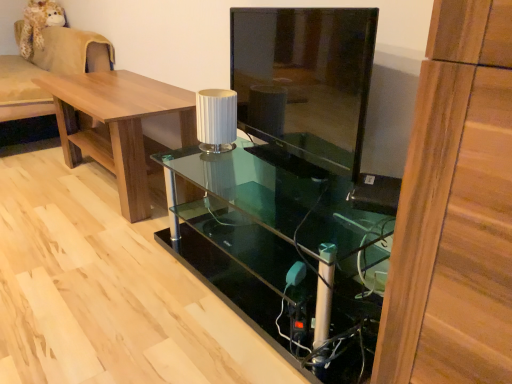
Locate an element on the screen. transparent glass tv stand at center is located at coordinates (305, 78).

The width and height of the screenshot is (512, 384). What are the coordinates of `brown wood table at left` in the screenshot? It's located at (117, 125).

Identify the location of transparent glass desk at center. This screenshot has height=384, width=512. (283, 253).

From their relative heights in the image, would you say white ribbed lampshade at center is taller or shorter than brown wood table at left?

white ribbed lampshade at center is shorter than brown wood table at left.

From a real-world perspective, between white ribbed lampshade at center and brown wood table at left, who is vertically lower?

From a 3D spatial view, brown wood table at left is below.

Is white ribbed lampshade at center looking in the opposite direction of brown wood table at left?

white ribbed lampshade at center is not turned away from brown wood table at left.

Would you say white ribbed lampshade at center is to the left or to the right of brown wood table at left in the picture?

In the image, white ribbed lampshade at center appears on the right side of brown wood table at left.

How many degrees apart are the facing directions of transparent glass tv stand at center and white ribbed lampshade at center?

4.01 degrees.

Is transparent glass tv stand at center looking in the opposite direction of white ribbed lampshade at center?

Yes.

The width and height of the screenshot is (512, 384). Find the location of `lamp below the transparent glass tv stand at center (from the image's perspective)`. lamp below the transparent glass tv stand at center (from the image's perspective) is located at coordinates (216, 120).

Considering the relative sizes of transparent glass tv stand at center and white ribbed lampshade at center in the image provided, is transparent glass tv stand at center wider than white ribbed lampshade at center?

Incorrect, the width of transparent glass tv stand at center does not surpass that of white ribbed lampshade at center.

Could you tell me if transparent glass desk at center is turned towards transparent glass tv stand at center?

No, transparent glass desk at center is not aimed at transparent glass tv stand at center.

From a real-world perspective, which is physically above, transparent glass desk at center or transparent glass tv stand at center?

In real-world perspective, transparent glass tv stand at center is above.

Which of these two, transparent glass desk at center or transparent glass tv stand at center, is smaller?

transparent glass tv stand at center is smaller.

Is transparent glass desk at center in front of transparent glass tv stand at center?

That is True.

Are brown wood table at left and beige fabric couch at left located far from each other?

No, brown wood table at left is in close proximity to beige fabric couch at left.

Does point (115, 157) appear closer or farther from the camera than point (95, 40)?

Clearly, point (115, 157) is closer to the camera than point (95, 40).

Considering the relative sizes of brown wood table at left and beige fabric couch at left in the image provided, is brown wood table at left taller than beige fabric couch at left?

In fact, brown wood table at left may be shorter than beige fabric couch at left.

At what (x,y) coordinates should I click in order to perform the action: click on desk that is under the beige fabric couch at left (from a real-world perspective). Please return your answer as a coordinate pair (x, y). Looking at the image, I should click on (283, 253).

Could you tell me if beige fabric couch at left is turned towards transparent glass desk at center?

No, beige fabric couch at left is not aimed at transparent glass desk at center.

Which object is closer to the camera taking this photo, beige fabric couch at left or transparent glass desk at center?

Positioned in front is transparent glass desk at center.

Is transparent glass tv stand at center oriented towards beige fabric couch at left?

No, transparent glass tv stand at center does not turn towards beige fabric couch at left.

What's the angular difference between transparent glass tv stand at center and beige fabric couch at left's facing directions?

They differ by 8.5 degrees in their facing directions.

Which of these two, transparent glass tv stand at center or beige fabric couch at left, is bigger?

With larger size is beige fabric couch at left.

From a real-world perspective, which object rests below the other?

beige fabric couch at left.

Is white ribbed lampshade at center taller than beige fabric couch at left?

Incorrect, the height of white ribbed lampshade at center is not larger of that of beige fabric couch at left.

Which is more distant, (218, 148) or (52, 69)?

The point (52, 69) is more distant.

Is white ribbed lampshade at center in front of beige fabric couch at left?

That is True.

Between white ribbed lampshade at center and beige fabric couch at left, which one appears on the right side from the viewer's perspective?

From the viewer's perspective, white ribbed lampshade at center appears more on the right side.

Identify the location of lamp that is above the brown wood table at left (from a real-world perspective). Image resolution: width=512 pixels, height=384 pixels. (216, 120).

The image size is (512, 384). Identify the location of glass door on the right of white ribbed lampshade at center. (305, 78).

From the image, which object appears to be nearer to white ribbed lampshade at center, beige fabric couch at left or transparent glass desk at center?

transparent glass desk at center.

Estimate the real-world distances between objects in this image. Which object is closer to beige fabric couch at left, transparent glass tv stand at center or white ribbed lampshade at center?

Based on the image, white ribbed lampshade at center appears to be nearer to beige fabric couch at left.

Based on their spatial positions, is brown wood table at left or white ribbed lampshade at center further from beige fabric couch at left?

white ribbed lampshade at center.

Based on their spatial positions, is brown wood table at left or beige fabric couch at left closer to white ribbed lampshade at center?

brown wood table at left lies closer to white ribbed lampshade at center than the other object.

In the scene shown: Which object lies nearer to the anchor point brown wood table at left, transparent glass desk at center or beige fabric couch at left?

transparent glass desk at center lies closer to brown wood table at left than the other object.

Looking at the image, which one is located closer to transparent glass tv stand at center, brown wood table at left or white ribbed lampshade at center?

white ribbed lampshade at center lies closer to transparent glass tv stand at center than the other object.

Considering their positions, is beige fabric couch at left positioned further to brown wood table at left than transparent glass tv stand at center?

Based on the image, transparent glass tv stand at center appears to be further to brown wood table at left.

When comparing their distances from transparent glass desk at center, does transparent glass tv stand at center or beige fabric couch at left seem closer?

The object closer to transparent glass desk at center is transparent glass tv stand at center.

This screenshot has width=512, height=384. Find the location of `lamp between brown wood table at left and transparent glass tv stand at center`. lamp between brown wood table at left and transparent glass tv stand at center is located at coordinates (216, 120).

In order to click on desk situated between brown wood table at left and transparent glass tv stand at center from left to right in this screenshot , I will do `click(283, 253)`.

Identify the location of lamp between brown wood table at left and transparent glass desk at center. The image size is (512, 384). (216, 120).

Find the location of a particular element. The width and height of the screenshot is (512, 384). glass door located between transparent glass desk at center and white ribbed lampshade at center in the depth direction is located at coordinates (305, 78).